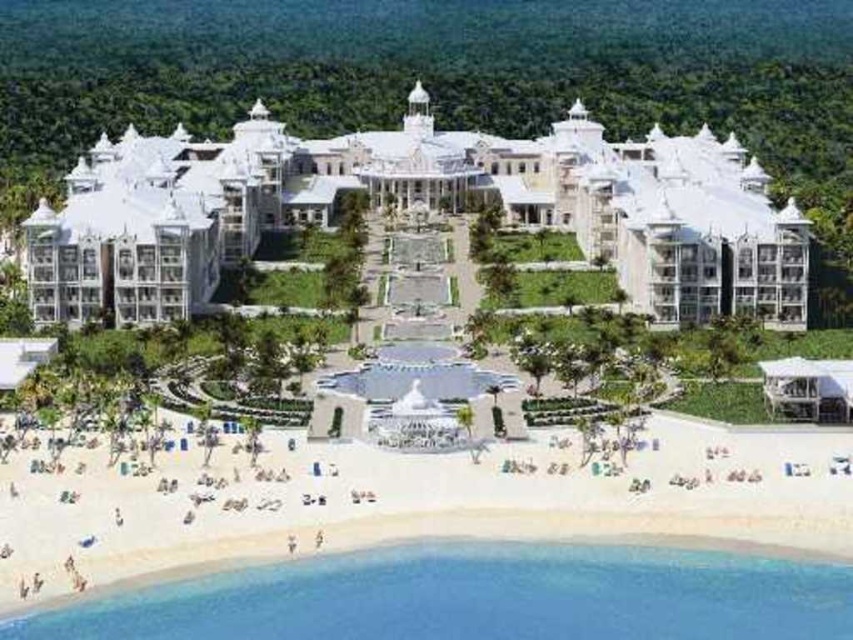
Does white glossy resort at center appear on the right side of white sand beach at lower left?

No, white glossy resort at center is not to the right of white sand beach at lower left.

Does white glossy resort at center appear on the left side of white sand beach at lower left?

Indeed, white glossy resort at center is positioned on the left side of white sand beach at lower left.

Is point (181, 192) farther from camera compared to point (202, 472)?

That is True.

This screenshot has height=640, width=853. What are the coordinates of `white glossy resort at center` in the screenshot? It's located at (416, 211).